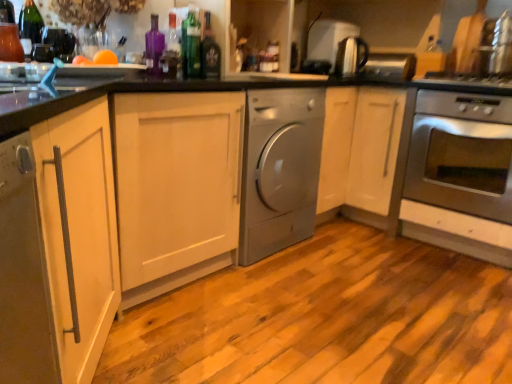
Question: Is shiny dark glass bottle at center, marked as the 1th bottle in a right-to-left arrangement, bigger or smaller than satin silver kettle at upper right, the first appliance when ordered from front to back?

Choices:
 (A) small
 (B) big

Answer: (A)

Question: Relative to satin silver kettle at upper right, the second appliance in the back-to-front sequence, is shiny dark glass bottle at center, marked as the 1th bottle in a right-to-left arrangement, in front or behind?

Choices:
 (A) behind
 (B) front

Answer: (B)

Question: Considering the real-world distances, which object is closest to the stainless steel oven at right?

Choices:
 (A) satin silver kettle at upper right, the first appliance when ordered from front to back
 (B) shiny dark glass bottle at center, which is counted as the 4th bottle, starting from the left
 (C) purple glass bottle at upper center, the second bottle positioned from the left
 (D) matte glass bottle at upper left, which is counted as the fourth bottle, starting from the right
 (E) satin silver toaster at upper center, the second appliance viewed from the front

Answer: (A)

Question: Which object is the closest to the satin silver dryer at center?

Choices:
 (A) satin silver toaster at upper center, the second appliance viewed from the front
 (B) purple glass bottle at upper center, the second bottle positioned from the left
 (C) stainless steel oven at right
 (D) shiny dark glass bottle at center, which is counted as the 4th bottle, starting from the left
 (E) green glass bottle at upper center, which is the 2th bottle in right-to-left order

Answer: (D)